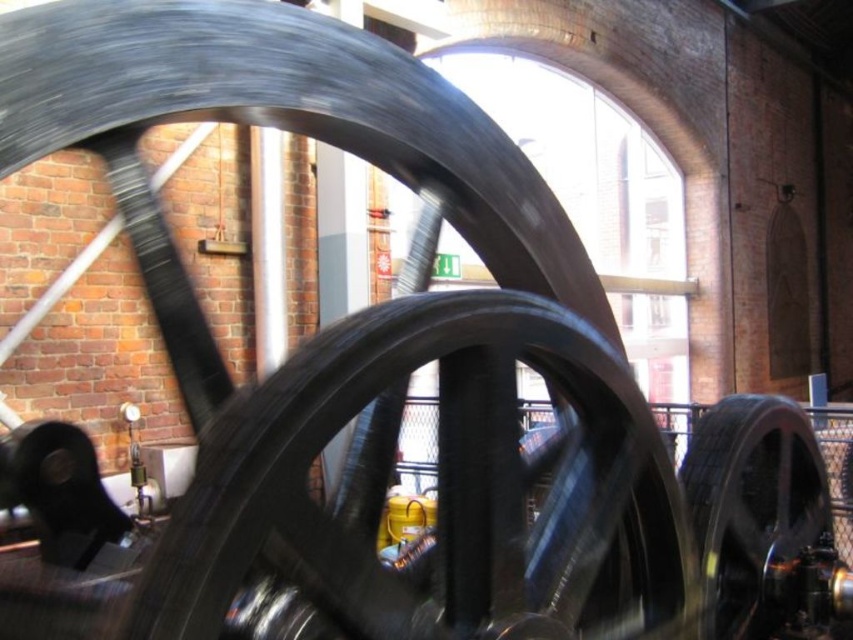
Question: Which point is closer to the camera?

Choices:
 (A) shiny black wheel at center
 (B) black matte wheel at center

Answer: (B)

Question: Among these points, which one is farthest from the camera?

Choices:
 (A) (686, 557)
 (B) (699, 500)

Answer: (B)

Question: Can you confirm if black matte wheel at center is positioned to the left of shiny black wheel at center?

Choices:
 (A) yes
 (B) no

Answer: (A)

Question: Can you confirm if black matte wheel at center is positioned to the left of shiny black wheel at center?

Choices:
 (A) yes
 (B) no

Answer: (A)

Question: Which point appears farthest from the camera in this image?

Choices:
 (A) tap(706, 602)
 (B) tap(310, 360)

Answer: (A)

Question: Is black matte wheel at center positioned behind shiny black wheel at center?

Choices:
 (A) yes
 (B) no

Answer: (B)